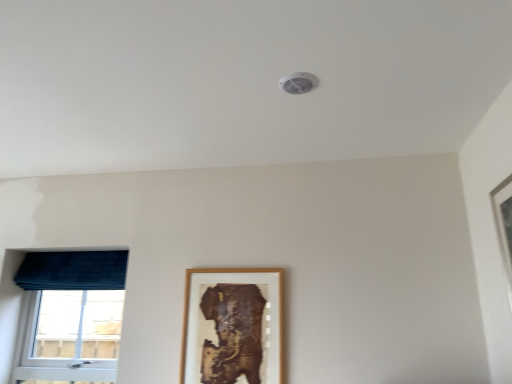
This screenshot has width=512, height=384. What do you see at coordinates (73, 270) in the screenshot?
I see `velvet blue curtain at left` at bounding box center [73, 270].

The height and width of the screenshot is (384, 512). Find the location of `velvet blue window at left`. velvet blue window at left is located at coordinates point(68,315).

What do you see at coordinates (233, 327) in the screenshot?
I see `wooden picture frame at center` at bounding box center [233, 327].

Identify the location of velvet blue curtain at left. (73, 270).

Considering the positions of points (58, 312) and (39, 256), is point (58, 312) farther from camera compared to point (39, 256)?

Yes, point (58, 312) is farther from viewer.

Which is correct: velvet blue window at left is inside velvet blue curtain at left, or outside of it?

The correct answer is: outside.

Is velvet blue window at left oriented towards velvet blue curtain at left?

Yes, velvet blue window at left is facing velvet blue curtain at left.

Which is less distant, (238, 329) or (100, 378)?

Point (238, 329) appears to be closer to the viewer than point (100, 378).

Do you think wooden picture frame at center is within velvet blue window at left, or outside of it?

wooden picture frame at center is not inside velvet blue window at left, it's outside.

Considering the sizes of objects wooden picture frame at center and velvet blue window at left in the image provided, who is wider, wooden picture frame at center or velvet blue window at left?

With larger width is velvet blue window at left.

Identify the location of picture frame that is in front of the velvet blue window at left. The image size is (512, 384). (233, 327).

Which is more to the left, velvet blue window at left or wooden picture frame at center?

velvet blue window at left is more to the left.

Is velvet blue window at left facing away from wooden picture frame at center?

No, velvet blue window at left is not facing the opposite direction of wooden picture frame at center.

Is wooden picture frame at center a part of velvet blue window at left?

No, wooden picture frame at center is located outside of velvet blue window at left.

Can you tell me how much velvet blue window at left and wooden picture frame at center differ in facing direction?

The facing directions of velvet blue window at left and wooden picture frame at center are 0.869 degrees apart.

Which object is thinner, wooden picture frame at center or velvet blue curtain at left?

With smaller width is wooden picture frame at center.

Looking at this image, which is farther from the camera, (234, 272) or (82, 276)?

Positioned behind is point (82, 276).

Can you confirm if wooden picture frame at center is taller than velvet blue curtain at left?

Yes.

Would you say wooden picture frame at center is a long distance from velvet blue curtain at left?

No, wooden picture frame at center is not far away from velvet blue curtain at left.

From the image's perspective, is velvet blue curtain at left located beneath wooden picture frame at center?

No, from the image's perspective, velvet blue curtain at left is not below wooden picture frame at center.

Considering the relative sizes of velvet blue curtain at left and wooden picture frame at center in the image provided, is velvet blue curtain at left thinner than wooden picture frame at center?

No.

Which is correct: velvet blue curtain at left is inside wooden picture frame at center, or outside of it?

velvet blue curtain at left lies outside wooden picture frame at center.

Is point (46, 263) behind point (272, 339)?

That is True.

Is velvet blue curtain at left turned away from velvet blue window at left?

Yes, velvet blue curtain at left is positioned with its back facing velvet blue window at left.

Which is behind, point (37, 265) or point (44, 285)?

The point (44, 285) is more distant.

The height and width of the screenshot is (384, 512). What are the coordinates of `window located underneath the velvet blue curtain at left (from a real-world perspective)` in the screenshot? It's located at (68, 315).

Is velvet blue curtain at left completely or partially outside of velvet blue window at left?

That's correct, velvet blue curtain at left is outside of velvet blue window at left.

Locate an element on the screen. curtain above the velvet blue window at left (from a real-world perspective) is located at coordinates (73, 270).

Locate an element on the screen. This screenshot has width=512, height=384. window behind the wooden picture frame at center is located at coordinates (68, 315).

When comparing their distances from wooden picture frame at center, does velvet blue window at left or velvet blue curtain at left seem closer?

The object closer to wooden picture frame at center is velvet blue curtain at left.

Based on their spatial positions, is wooden picture frame at center or velvet blue curtain at left closer to velvet blue window at left?

velvet blue curtain at left lies closer to velvet blue window at left than the other object.

When comparing their distances from velvet blue window at left, does velvet blue curtain at left or wooden picture frame at center seem closer?

velvet blue curtain at left lies closer to velvet blue window at left than the other object.

Based on their spatial positions, is wooden picture frame at center or velvet blue window at left further from velvet blue curtain at left?

wooden picture frame at center.

Considering their positions, is velvet blue curtain at left positioned further to wooden picture frame at center than velvet blue window at left?

velvet blue window at left is further to wooden picture frame at center.

Estimate the real-world distances between objects in this image. Which object is closer to velvet blue curtain at left, velvet blue window at left or wooden picture frame at center?

The object closer to velvet blue curtain at left is velvet blue window at left.

Locate an element on the screen. The image size is (512, 384). curtain between velvet blue window at left and wooden picture frame at center in the horizontal direction is located at coordinates (73, 270).